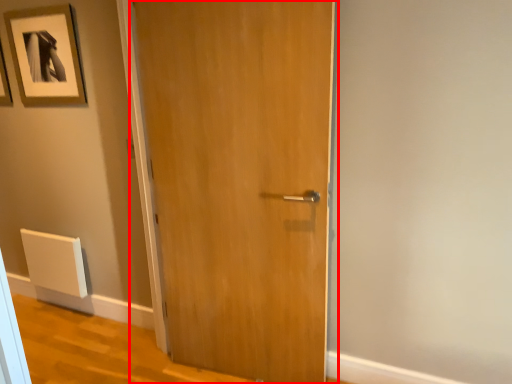
Question: From the image's perspective, what is the correct spatial positioning of door (annotated by the red box) in reference to picture frame?

Choices:
 (A) above
 (B) below

Answer: (B)